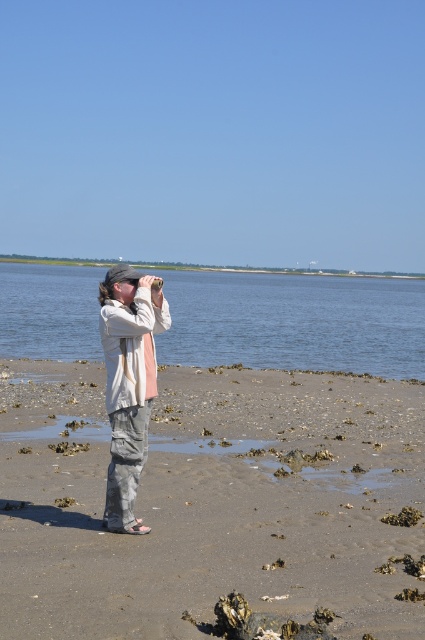
Between brown sandy beach at center and blue water at center, which one is positioned higher?

blue water at center is higher up.

Is brown sandy beach at center bigger than blue water at center?

Incorrect, brown sandy beach at center is not larger than blue water at center.

Does point (312, 524) come in front of point (61, 301)?

Yes, point (312, 524) is closer to viewer.

Locate an element on the screen. This screenshot has height=640, width=425. brown sandy beach at center is located at coordinates (220, 515).

Measure the distance between blue water at center and light gray cotton pants at center.

blue water at center and light gray cotton pants at center are 36.78 meters apart from each other.

Describe the element at coordinates (295, 323) in the screenshot. I see `blue water at center` at that location.

Between point (184, 317) and point (110, 419), which one is positioned in front?

Positioned in front is point (110, 419).

You are a GUI agent. You are given a task and a screenshot of the screen. Output one action in this format:
    pyautogui.click(x=<x>, y=<y>)
    Task: Click on the blue water at center
    Image resolution: width=425 pixels, height=640 pixels.
    Given the screenshot: What is the action you would take?
    pyautogui.click(x=295, y=323)

Can you confirm if brown sandy beach at center is positioned above light gray cotton pants at center?

No, brown sandy beach at center is not above light gray cotton pants at center.

This screenshot has width=425, height=640. Describe the element at coordinates (220, 515) in the screenshot. I see `brown sandy beach at center` at that location.

I want to click on brown sandy beach at center, so click(x=220, y=515).